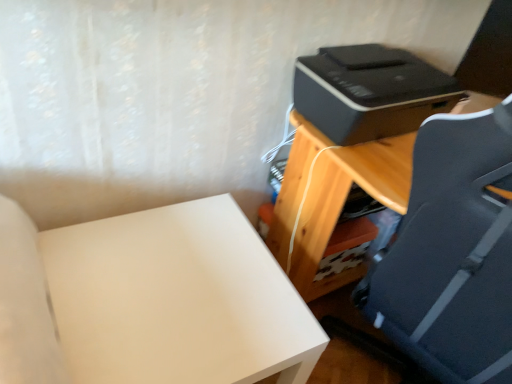
Question: Can you confirm if black plastic printer at upper right is taller than wooden desk at right?

Choices:
 (A) no
 (B) yes

Answer: (A)

Question: From the image's perspective, would you say black plastic printer at upper right is shown under wooden desk at right?

Choices:
 (A) no
 (B) yes

Answer: (A)

Question: Can you confirm if black plastic printer at upper right is wider than wooden desk at right?

Choices:
 (A) yes
 (B) no

Answer: (B)

Question: Can you confirm if black plastic printer at upper right is bigger than wooden desk at right?

Choices:
 (A) no
 (B) yes

Answer: (A)

Question: Considering the relative sizes of black plastic printer at upper right and wooden desk at right in the image provided, is black plastic printer at upper right smaller than wooden desk at right?

Choices:
 (A) yes
 (B) no

Answer: (A)

Question: Is black plastic printer at upper right positioned with its back to wooden desk at right?

Choices:
 (A) yes
 (B) no

Answer: (B)

Question: Is black plastic printer at upper right completely or partially inside white matte table at lower left?

Choices:
 (A) yes
 (B) no

Answer: (B)

Question: From the image's perspective, is white matte table at lower left under black plastic printer at upper right?

Choices:
 (A) yes
 (B) no

Answer: (A)

Question: Considering the relative sizes of white matte table at lower left and black plastic printer at upper right in the image provided, is white matte table at lower left taller than black plastic printer at upper right?

Choices:
 (A) no
 (B) yes

Answer: (B)

Question: Is white matte table at lower left positioned with its back to black plastic printer at upper right?

Choices:
 (A) no
 (B) yes

Answer: (A)

Question: Is the position of white matte table at lower left less distant than that of black plastic printer at upper right?

Choices:
 (A) yes
 (B) no

Answer: (A)

Question: From a real-world perspective, is white matte table at lower left on black plastic printer at upper right?

Choices:
 (A) yes
 (B) no

Answer: (B)

Question: Can you confirm if white matte table at lower left is wider than wooden desk at right?

Choices:
 (A) yes
 (B) no

Answer: (B)